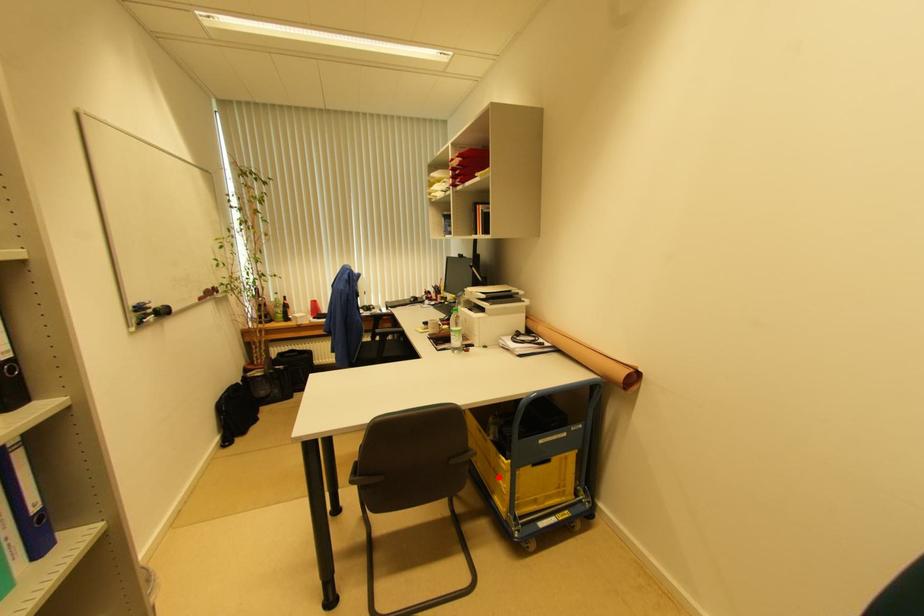
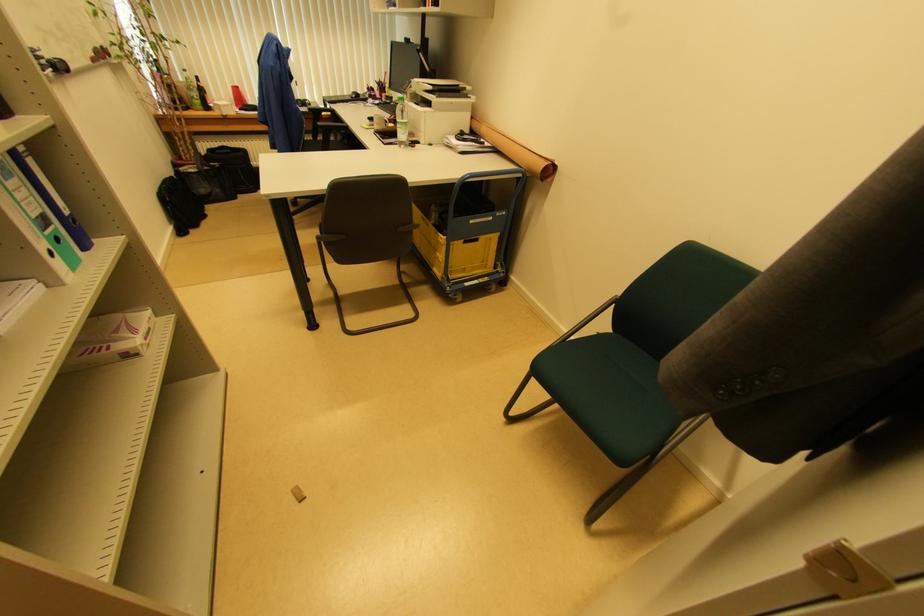
In the second image, find the point that corresponds to the highlighted location in the first image.

(438, 253)